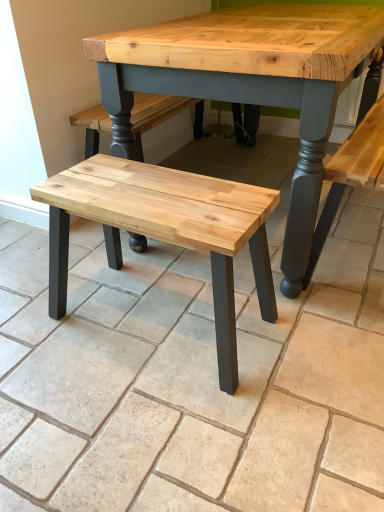
The image size is (384, 512). I want to click on vacant area on top of natural wood stool at center (from a real-world perspective), so tap(154, 187).